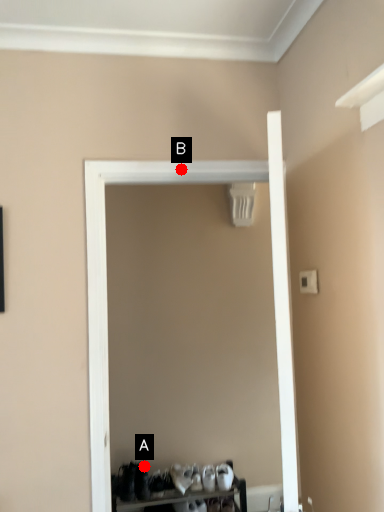
Question: Two points are circled on the image, labeled by A and B beside each circle. Which point is farther to the camera?

Choices:
 (A) A is further
 (B) B is further

Answer: (A)